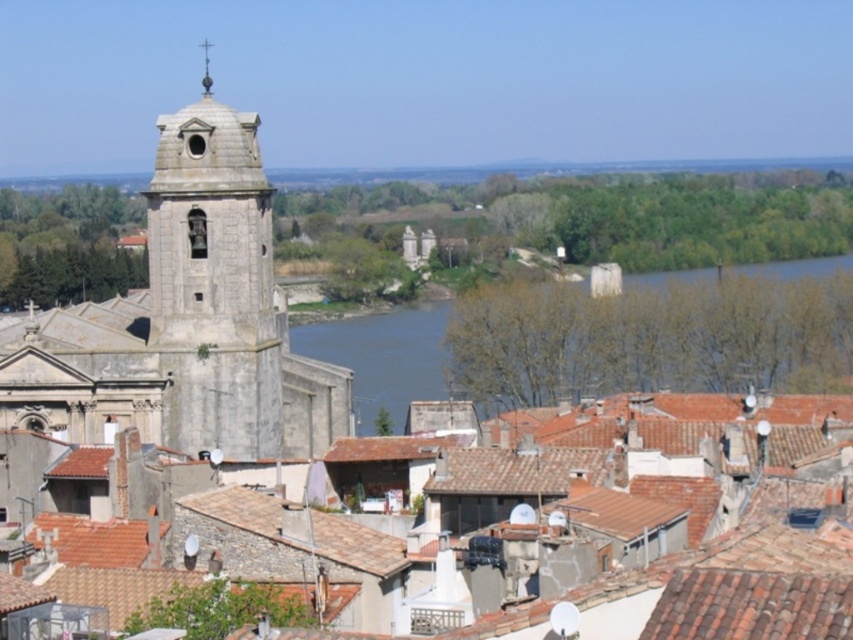
You are a tourist standing in front of the gray stone church at left and the stone bell tower at left. You want to take a photo that includes both structures in the frame. Given that your camera has a maximum horizontal field of view of 60 degrees, can you estimate if both structures will fit in the photo without moving closer or farther away?

The gray stone church at left and the stone bell tower at left are 1.81 meters apart from each other. To determine if they fit within a 60 degree field of view, we can use trigonometry. The distance from the camera to the structures and their separation are needed. However, since the exact distance isn

You are standing at the camera position and want to take a photo of the stone bell tower at left. If your camera can focus on objects up to 300 feet away, will you be able to capture the tower clearly?

The stone bell tower at left is 344.04 feet away from the camera, which is beyond the camera focus range of 300 feet. Therefore, the tower will not be in focus.